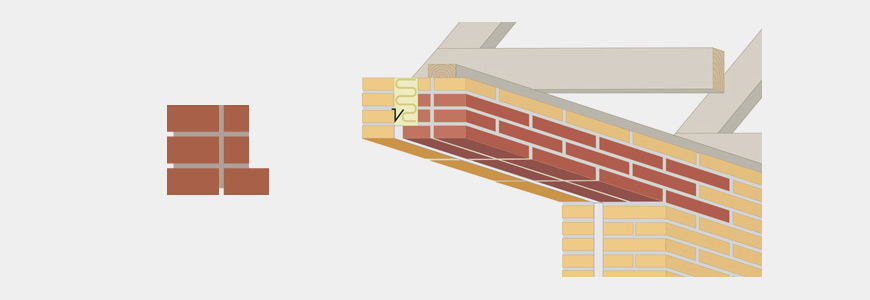
The height and width of the screenshot is (300, 870). What are the coordinates of `beams` in the screenshot? It's located at (626, 65), (713, 117).